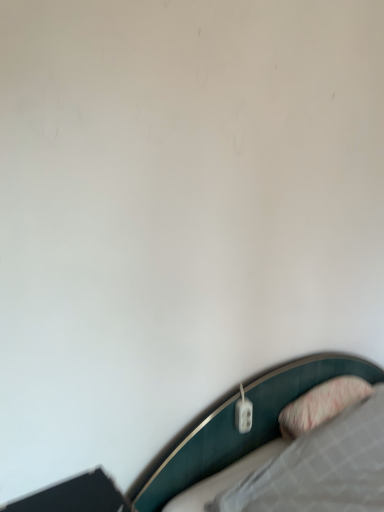
Question: Does white plastic electric outlet at lower right come in front of pink textured pillow at lower right?

Choices:
 (A) yes
 (B) no

Answer: (B)

Question: Considering the relative sizes of white plastic electric outlet at lower right and pink textured pillow at lower right in the image provided, is white plastic electric outlet at lower right bigger than pink textured pillow at lower right?

Choices:
 (A) yes
 (B) no

Answer: (B)

Question: Is white plastic electric outlet at lower right smaller than pink textured pillow at lower right?

Choices:
 (A) no
 (B) yes

Answer: (B)

Question: Would you say white plastic electric outlet at lower right is a long distance from pink textured pillow at lower right?

Choices:
 (A) yes
 (B) no

Answer: (B)

Question: From a real-world perspective, is white plastic electric outlet at lower right on top of pink textured pillow at lower right?

Choices:
 (A) no
 (B) yes

Answer: (B)

Question: Is white plastic electric outlet at lower right further to the viewer compared to pink textured pillow at lower right?

Choices:
 (A) no
 (B) yes

Answer: (B)

Question: Is pink textured pillow at lower right wider than white plastic electric outlet at lower right?

Choices:
 (A) yes
 (B) no

Answer: (A)

Question: Is white plastic electric outlet at lower right inside pink textured pillow at lower right?

Choices:
 (A) yes
 (B) no

Answer: (B)

Question: Is pink textured pillow at lower right facing away from white plastic electric outlet at lower right?

Choices:
 (A) yes
 (B) no

Answer: (B)

Question: Considering the relative sizes of pink textured pillow at lower right and white plastic electric outlet at lower right in the image provided, is pink textured pillow at lower right thinner than white plastic electric outlet at lower right?

Choices:
 (A) no
 (B) yes

Answer: (A)

Question: From the image's perspective, does pink textured pillow at lower right appear higher than white plastic electric outlet at lower right?

Choices:
 (A) no
 (B) yes

Answer: (A)

Question: Does pink textured pillow at lower right turn towards white plastic electric outlet at lower right?

Choices:
 (A) yes
 (B) no

Answer: (B)

Question: Is pink textured pillow at lower right in front of or behind white plastic electric outlet at lower right in the image?

Choices:
 (A) behind
 (B) front

Answer: (B)